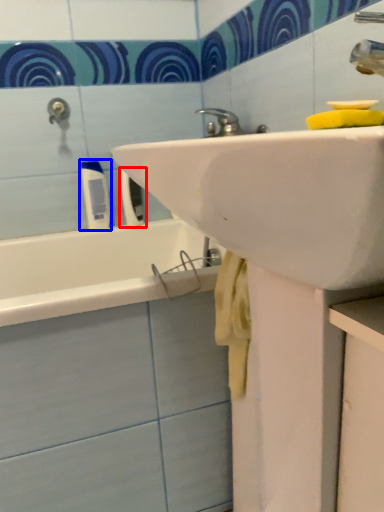
Question: Which object is closer to the camera taking this photo, toiletry (highlighted by a red box) or toiletry (highlighted by a blue box)?

Choices:
 (A) toiletry
 (B) toiletry

Answer: (B)